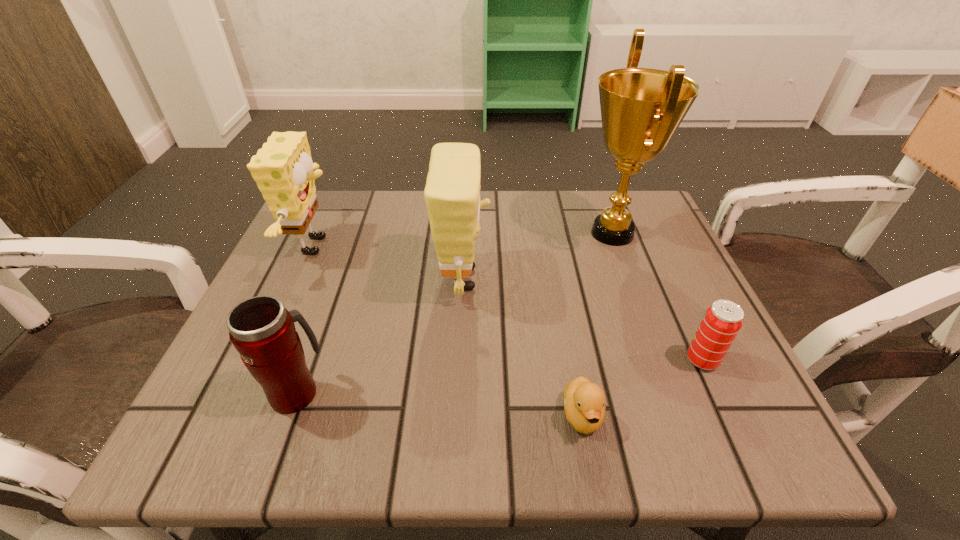
You are a GUI agent. You are given a task and a screenshot of the screen. Output one action in this format:
    pyautogui.click(x=<x>, y=<y>)
    Task: Click on the sponge situated at the left edge
    The image size is (960, 540).
    Given the screenshot: What is the action you would take?
    pyautogui.click(x=283, y=169)

Find the location of a particular element. This screenshot has width=960, height=540. thermos bottle that is at the left edge is located at coordinates (263, 332).

This screenshot has width=960, height=540. What are the coordinates of `award located in the right edge section of the desktop` in the screenshot? It's located at (641, 108).

Where is `soda can positioned at the right edge`? The image size is (960, 540). soda can positioned at the right edge is located at coordinates (722, 321).

At what (x,y) coordinates should I click in order to perform the action: click on object at the far left corner. Please return your answer as a coordinate pair (x, y). Image resolution: width=960 pixels, height=540 pixels. Looking at the image, I should click on (283, 169).

At what (x,y) coordinates should I click in order to perform the action: click on object that is at the near left corner. Please return your answer as a coordinate pair (x, y). The width and height of the screenshot is (960, 540). Looking at the image, I should click on (263, 332).

You are a GUI agent. You are given a task and a screenshot of the screen. Output one action in this format:
    pyautogui.click(x=<x>, y=<y>)
    Task: Click on the object situated at the far right corner
    The image size is (960, 540).
    Given the screenshot: What is the action you would take?
    pyautogui.click(x=641, y=108)

Image resolution: width=960 pixels, height=540 pixels. I want to click on vacant space at the far edge of the desktop, so click(x=584, y=220).

Locate an element on the screen. vacant space at the near edge of the desktop is located at coordinates (584, 454).

Identify the location of free space at the left edge of the desktop. (291, 299).